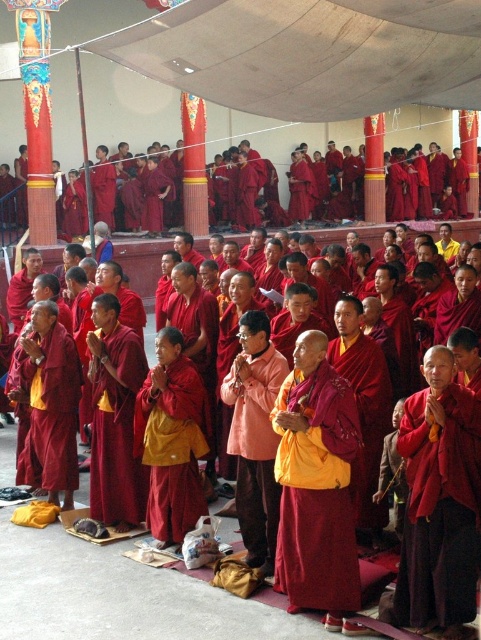
Who is taller, yellow matte robe at center or matte orange robe at center?

With more height is yellow matte robe at center.

Can you confirm if yellow matte robe at center is positioned to the right of matte orange robe at center?

No, yellow matte robe at center is not to the right of matte orange robe at center.

What are the coordinates of `yellow matte robe at center` in the screenshot? It's located at (173, 449).

Consider the image. Is matte red robe at lower right taller than matte orange robe at center?

Indeed, matte red robe at lower right has a greater height compared to matte orange robe at center.

Measure the distance between matte red robe at lower right and matte orange robe at center.

matte red robe at lower right is 7.54 meters away from matte orange robe at center.

Who is more forward, (433, 516) or (267, 458)?

Point (433, 516) is more forward.

Find the location of `matte red robe at lower right`. matte red robe at lower right is located at coordinates (440, 512).

Can you confirm if matte red robe at lower right is wider than yellow matte robe at center?

Incorrect, matte red robe at lower right's width does not surpass yellow matte robe at center's.

Is matte red robe at lower right taller than yellow matte robe at center?

No.

Is point (451, 568) positioned before point (164, 508)?

That is True.

Where is `matte red robe at lower right`? This screenshot has width=481, height=640. matte red robe at lower right is located at coordinates (440, 512).